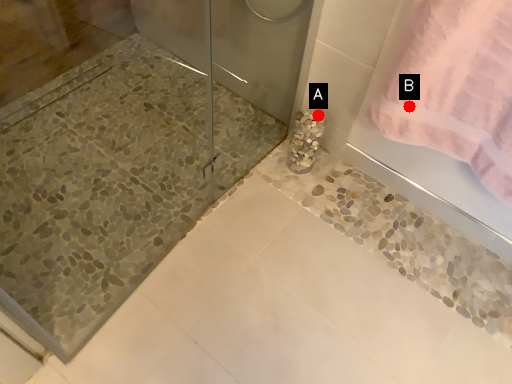
Question: Two points are circled on the image, labeled by A and B beside each circle. Which point is closer to the camera?

Choices:
 (A) A is closer
 (B) B is closer

Answer: (B)